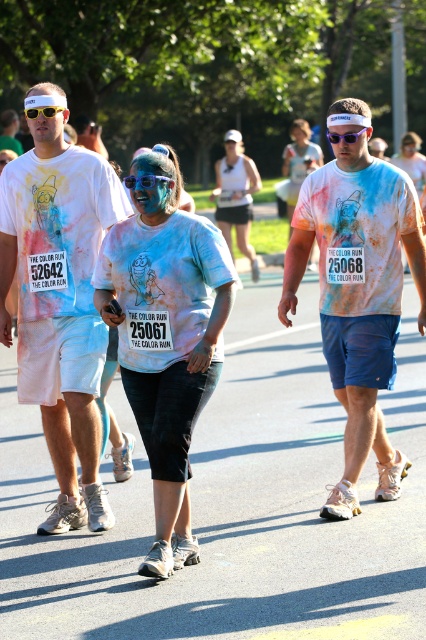
Question: Is matte tie-dye t-shirt at center to the left of blue matte goggles at center from the viewer's perspective?

Choices:
 (A) yes
 (B) no

Answer: (A)

Question: Can you confirm if blue matte goggles at center is smaller than blue plastic sunglasses at center?

Choices:
 (A) no
 (B) yes

Answer: (A)

Question: Can you confirm if matte tie-dye t-shirt at center is wider than white tie-dye t-shirt at center?

Choices:
 (A) no
 (B) yes

Answer: (A)

Question: Which point appears closest to the camera in this image?

Choices:
 (A) (391, 250)
 (B) (54, 115)
 (C) (89, 308)
 (D) (152, 184)

Answer: (D)

Question: Which object is the farthest from the blue matte goggles at center?

Choices:
 (A) tie-dye t-shirt at center
 (B) blue plastic sunglasses at center
 (C) matte tie-dye t-shirt at center

Answer: (A)

Question: Which of these objects is positioned closest to the yellow plastic goggles at center?

Choices:
 (A) matte tie-dye t-shirt at center
 (B) blue plastic sunglasses at center
 (C) white tie-dye t-shirt at center

Answer: (A)